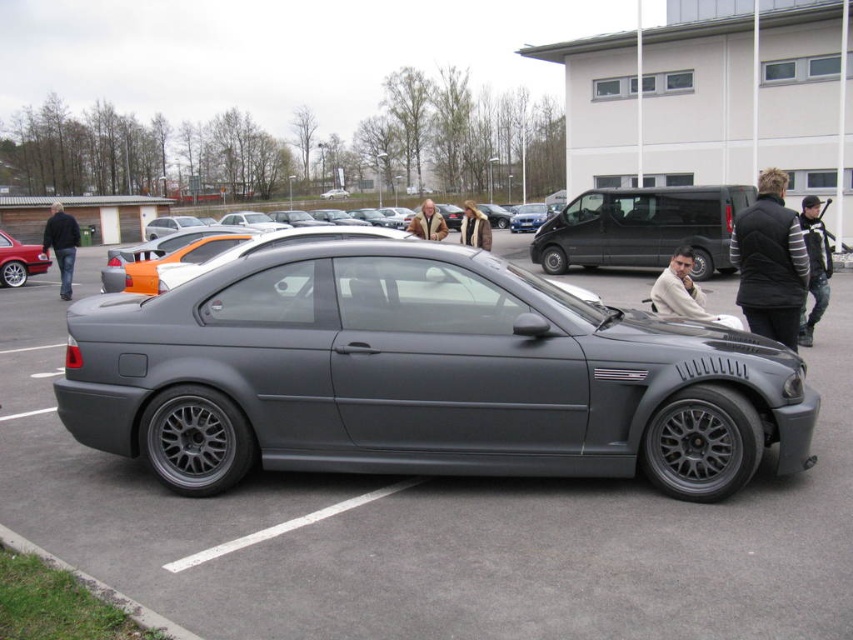
You are a delivery person trying to park your van in the parking lot. You see the matte gray car at center and the striped sweater at right. Which object is bigger in size?

The striped sweater at right is bigger than the matte gray car at center.

You are a delivery person trying to park your delivery van, which is 2 meters wide. You see the matte gray car at center and the striped sweater at right in the parking lot. Can you safely park your van between them without hitting either?

The matte gray car at center might be wider than striped sweater at right. However, since the exact width difference isn not specified, it is uncertain whether there is enough space between them for your 2 meter wide van. You should measure the gap before proceeding.